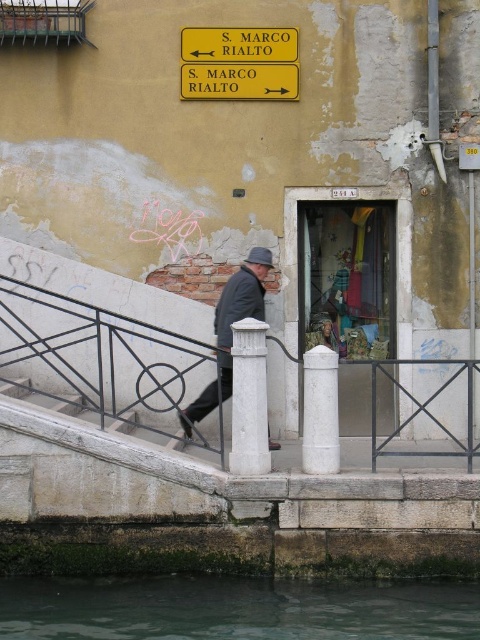
You are standing on the canal side and see the white stone post at center and the white smooth pillar at lower center. Which one is positioned to the left of the other?

The white stone post at center is positioned to the left of the white smooth pillar at lower center.